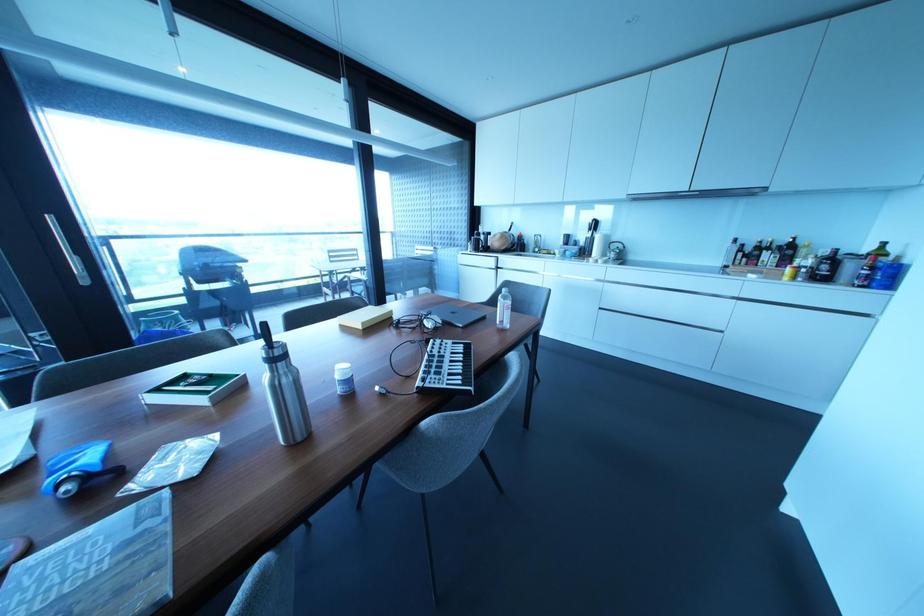
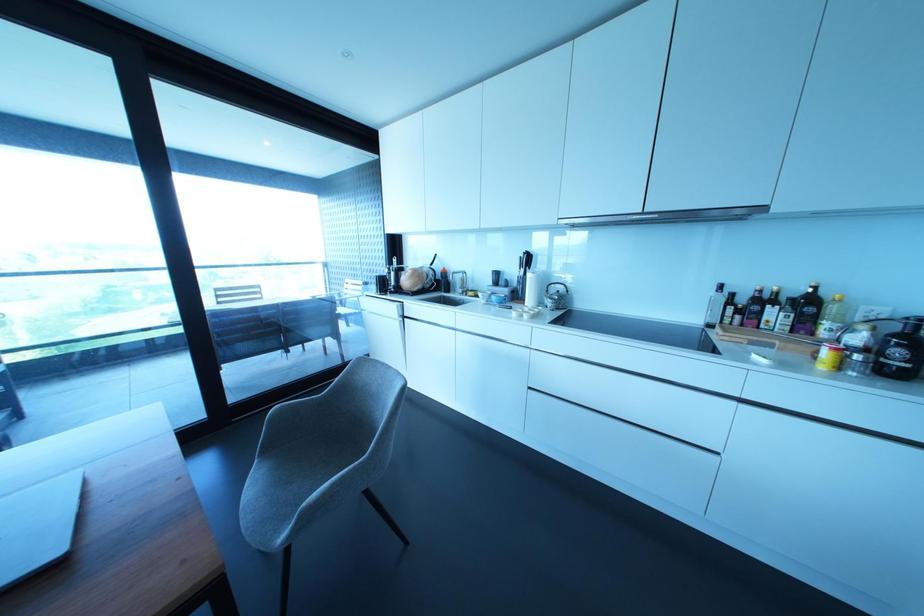
In the second image, find the point that corresponds to (789,248) in the first image.

(807, 304)